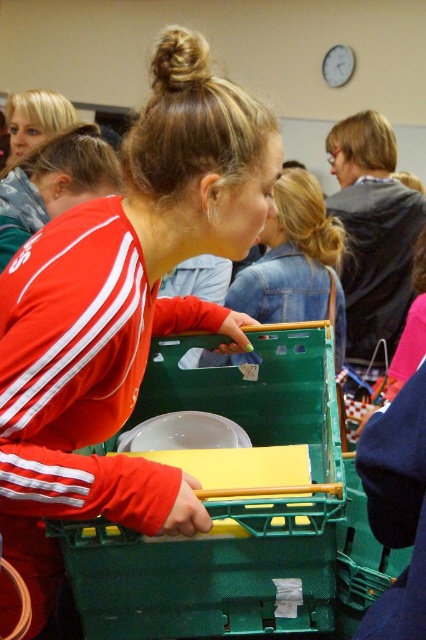
Question: In this image, where is matte red jacket at center located relative to green plastic crate at center?

Choices:
 (A) left
 (B) right

Answer: (A)

Question: Can you confirm if matte red jacket at center is thinner than green plastic crate at center?

Choices:
 (A) no
 (B) yes

Answer: (B)

Question: Considering the relative positions of matte red jacket at center and green plastic crate at center in the image provided, where is matte red jacket at center located with respect to green plastic crate at center?

Choices:
 (A) right
 (B) left

Answer: (B)

Question: Which is nearer to the green plastic crate at center?

Choices:
 (A) matte plastic shopping cart at center
 (B) matte red jacket at center

Answer: (B)

Question: Considering the real-world distances, which object is closest to the matte red jacket at center?

Choices:
 (A) matte plastic shopping cart at center
 (B) green plastic crate at center

Answer: (B)

Question: Estimate the real-world distances between objects in this image. Which object is closer to the matte plastic shopping cart at center?

Choices:
 (A) green plastic crate at center
 (B) matte red jacket at center

Answer: (A)